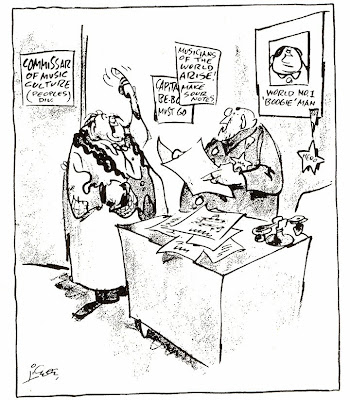
The image size is (350, 400). Find the location of `desk`. desk is located at coordinates (223, 313).